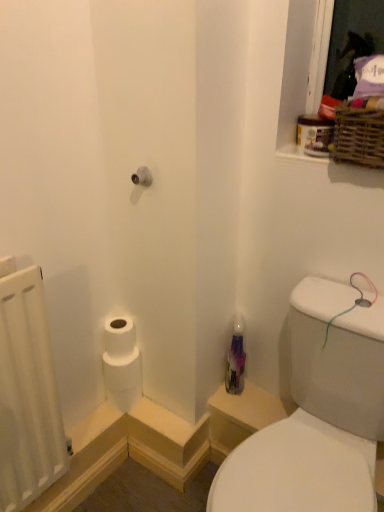
Question: Is white matte radiator at left bigger than transparent plastic bottle at lower right?

Choices:
 (A) no
 (B) yes

Answer: (A)

Question: Would you say white matte radiator at left is a long distance from transparent plastic bottle at lower right?

Choices:
 (A) no
 (B) yes

Answer: (A)

Question: Are white matte radiator at left and transparent plastic bottle at lower right making contact?

Choices:
 (A) no
 (B) yes

Answer: (A)

Question: Is white matte radiator at left facing away from transparent plastic bottle at lower right?

Choices:
 (A) no
 (B) yes

Answer: (A)

Question: From the image's perspective, is white matte radiator at left beneath transparent plastic bottle at lower right?

Choices:
 (A) yes
 (B) no

Answer: (B)

Question: Considering the relative positions of white matte radiator at left and transparent plastic bottle at lower right in the image provided, is white matte radiator at left in front of transparent plastic bottle at lower right?

Choices:
 (A) no
 (B) yes

Answer: (A)

Question: Could you tell me if white matte radiator at left is turned towards white matte toilet paper at lower left?

Choices:
 (A) yes
 (B) no

Answer: (B)

Question: Are white matte radiator at left and white matte toilet paper at lower left beside each other?

Choices:
 (A) yes
 (B) no

Answer: (B)

Question: Would you say white matte toilet paper at lower left is part of white matte radiator at left's contents?

Choices:
 (A) yes
 (B) no

Answer: (B)

Question: Can you confirm if white matte radiator at left is shorter than white matte toilet paper at lower left?

Choices:
 (A) no
 (B) yes

Answer: (A)

Question: From the image's perspective, is white matte radiator at left beneath white matte toilet paper at lower left?

Choices:
 (A) yes
 (B) no

Answer: (B)

Question: Does white matte radiator at left come behind white matte toilet paper at lower left?

Choices:
 (A) yes
 (B) no

Answer: (B)

Question: From the image's perspective, is transparent plastic bottle at lower right under woven brown basket at upper right?

Choices:
 (A) yes
 (B) no

Answer: (A)